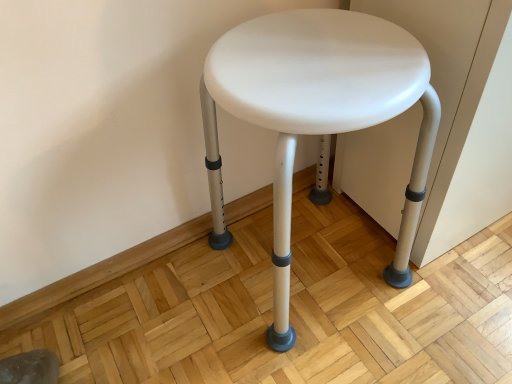
Identify the location of empty space that is to the right of white plastic stool at center. Image resolution: width=512 pixels, height=384 pixels. (453, 300).